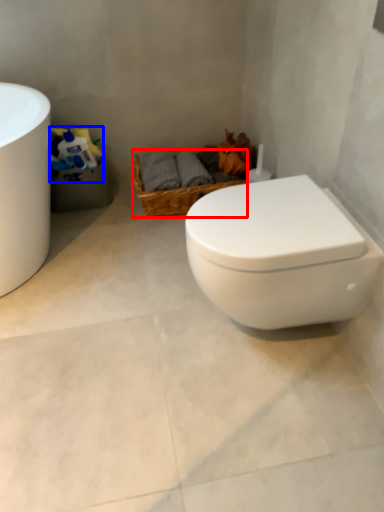
Question: Which object appears closest to the camera in this image, basket (highlighted by a red box) or toilet paper (highlighted by a blue box)?

Choices:
 (A) basket
 (B) toilet paper

Answer: (B)